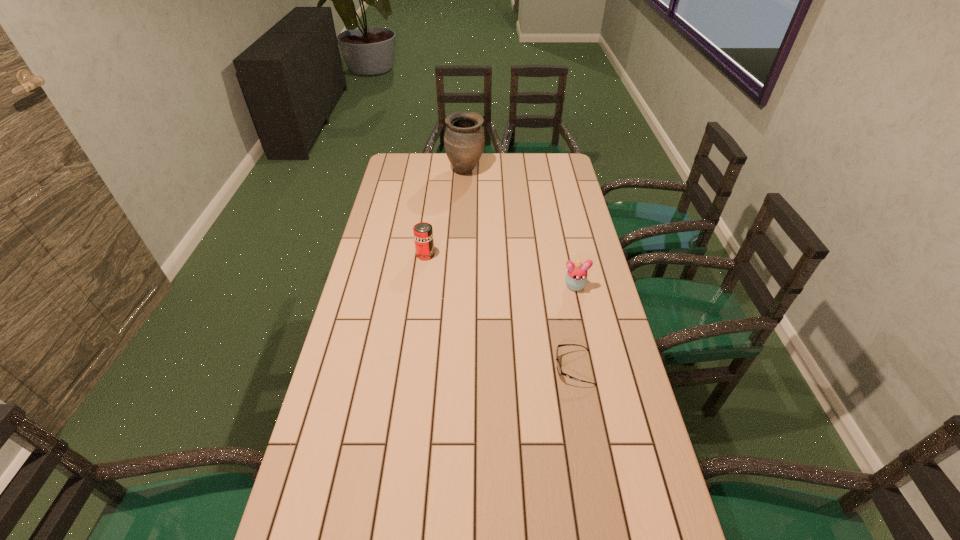
At what (x,y) coordinates should I click in order to perform the action: click on free space between the third object from right to left and the second farthest object. Please return your answer as a coordinate pair (x, y). The image size is (960, 540). Looking at the image, I should click on (445, 213).

Where is `free space between the cupcake and the tallest object`? free space between the cupcake and the tallest object is located at coordinates (519, 228).

Locate an element on the screen. The image size is (960, 540). vacant space that is in between the third farthest object and the sunglasses is located at coordinates (574, 327).

Image resolution: width=960 pixels, height=540 pixels. I want to click on free space between the second nearest object and the nearest object, so click(574, 327).

What are the coordinates of `free space between the third object from right to left and the second farthest object` in the screenshot? It's located at (445, 213).

Locate an element on the screen. free space between the third object from right to left and the cupcake is located at coordinates (519, 228).

Locate an element on the screen. object that stands as the second closest to the leftmost object is located at coordinates (464, 140).

The height and width of the screenshot is (540, 960). I want to click on object that is the nearest to the sunglasses, so click(576, 278).